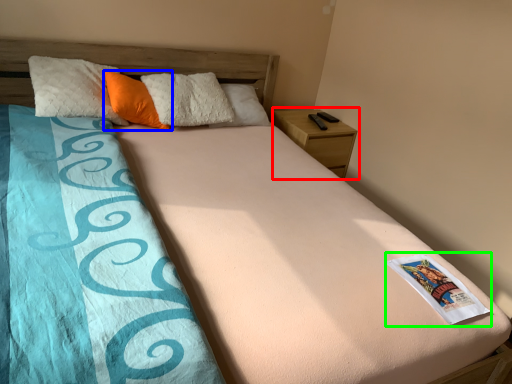
Question: Which is nearer to the nightstand (highlighted by a red box)? pillow (highlighted by a blue box) or paperback book (highlighted by a green box).

Choices:
 (A) pillow
 (B) paperback book

Answer: (A)